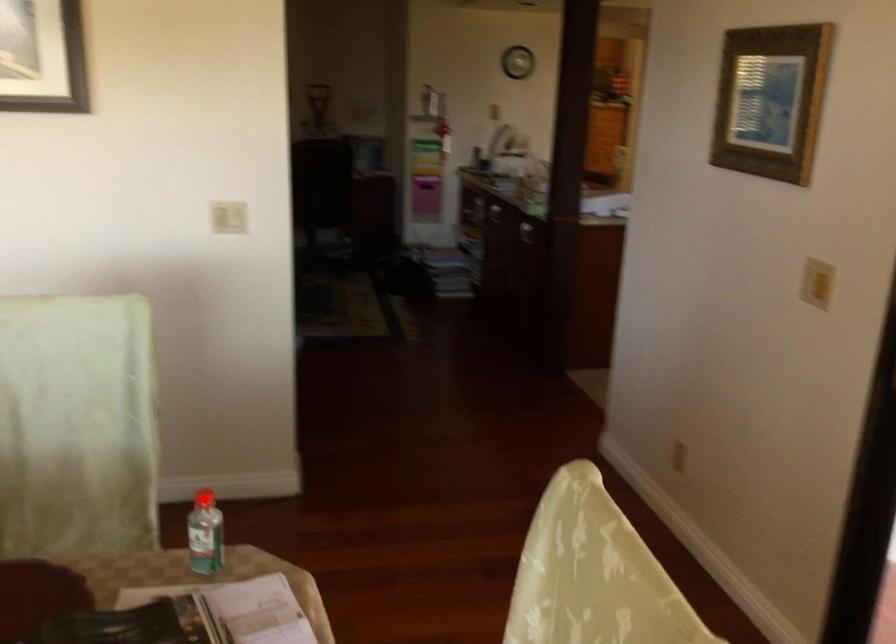
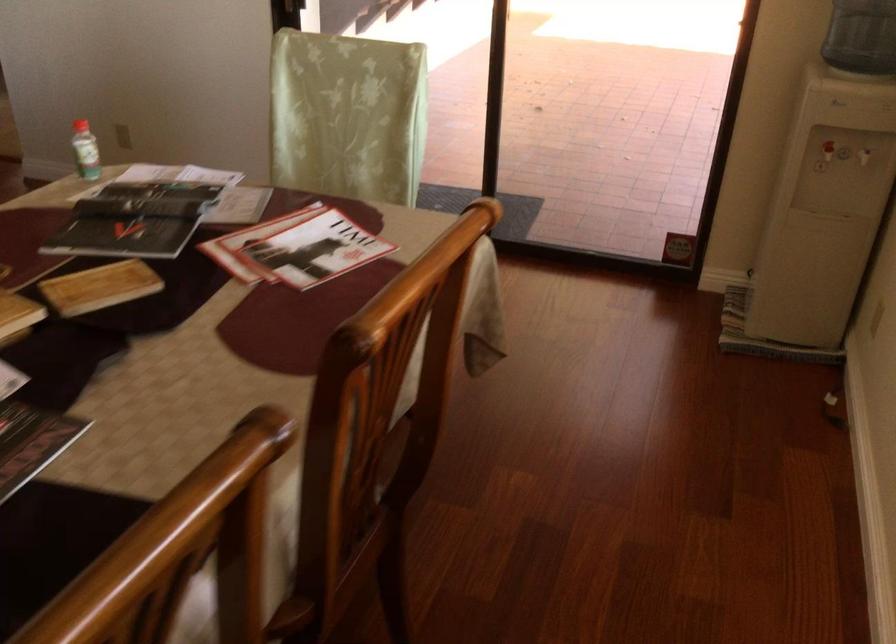
Question: I am providing you with two images of the same scene from different viewpoints. A red point is marked on the first image. At the location where the point appears in image 1, is it still visible in image 2?

Choices:
 (A) Yes
 (B) No

Answer: (B)